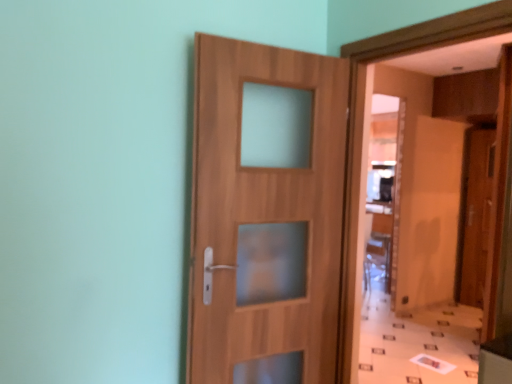
Question: Relative to wooden door at right, the 1th door viewed from the right, is wooden door at center, which is the 2th door from right to left, in front or behind?

Choices:
 (A) front
 (B) behind

Answer: (A)

Question: From a real-world perspective, relative to wooden door at right, marked as the second door in a front-to-back arrangement, is wooden door at center, which ranks as the 2th door in back-to-front order, vertically above or below?

Choices:
 (A) above
 (B) below

Answer: (A)

Question: Considering the positions of wooden door at center, which is the 2th door from right to left, and wooden door at right, which is the 1th door in back-to-front order, in the image, is wooden door at center, which is the 2th door from right to left, taller or shorter than wooden door at right, which is the 1th door in back-to-front order,?

Choices:
 (A) short
 (B) tall

Answer: (A)

Question: Is wooden door at right, the second door in the left-to-right sequence, wider or thinner than wooden door at center, which is the first door from left to right?

Choices:
 (A) wide
 (B) thin

Answer: (A)

Question: Considering the positions of wooden door at right, marked as the second door in a front-to-back arrangement, and wooden door at center, which is the first door from left to right, in the image, is wooden door at right, marked as the second door in a front-to-back arrangement, taller or shorter than wooden door at center, which is the first door from left to right,?

Choices:
 (A) tall
 (B) short

Answer: (A)

Question: Is wooden door at right, which is the 1th door in back-to-front order, inside the boundaries of wooden door at center, which is the 2th door from right to left, or outside?

Choices:
 (A) outside
 (B) inside

Answer: (A)

Question: From a real-world perspective, is wooden door at right, the second door in the left-to-right sequence, above or below wooden door at center, which is the first door from left to right?

Choices:
 (A) below
 (B) above

Answer: (A)